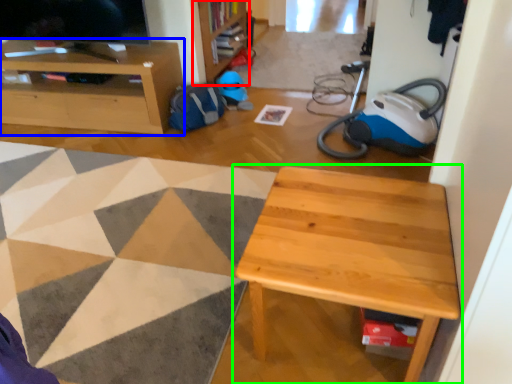
Question: Estimate the real-world distances between objects in this image. Which object is farther from bookshelf (highlighted by a red box), cabinetry (highlighted by a blue box) or table (highlighted by a green box)?

Choices:
 (A) cabinetry
 (B) table

Answer: (B)